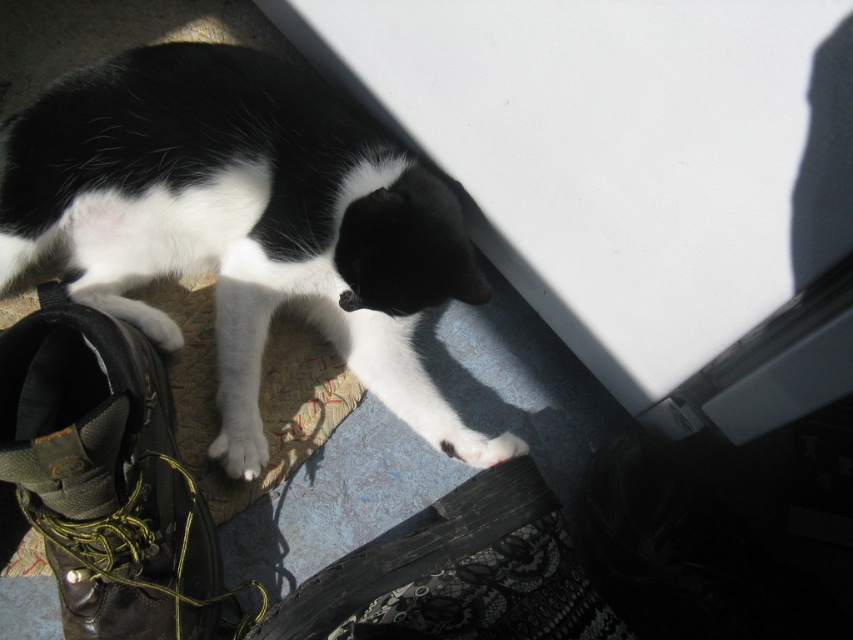
You are a photographer trying to capture the black and white fur cat at lower left and the leather boot at lower left in the same frame. Based on their heights, which one should you focus on first to ensure both are in focus?

The black and white fur cat at lower left is much taller than the leather boot at lower left, so you should focus on the cat first to ensure both are in focus.

You are a cat owner observing your cat walking on a mixed flooring area. You notice the black and white fur cat at lower left and the white soft fur paw at lower left. Which object is located to the right of the other?

The black and white fur cat at lower left is positioned on the right side of white soft fur paw at lower left, so the cat is to the right of its paw.